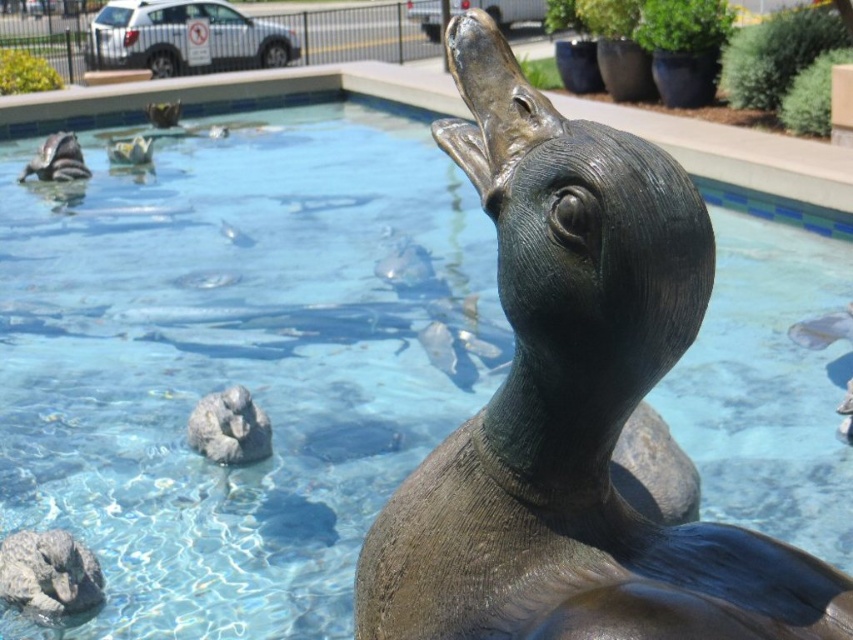
You are standing near the bronze statue of a sea lion and want to place a small potted plant between the gray stone rock at lower left and the gray stone rock at center. Can you do this without moving either rock?

The gray stone rock at lower left is positioned under the gray stone rock at center, so there is no space between them for placing a potted plant.